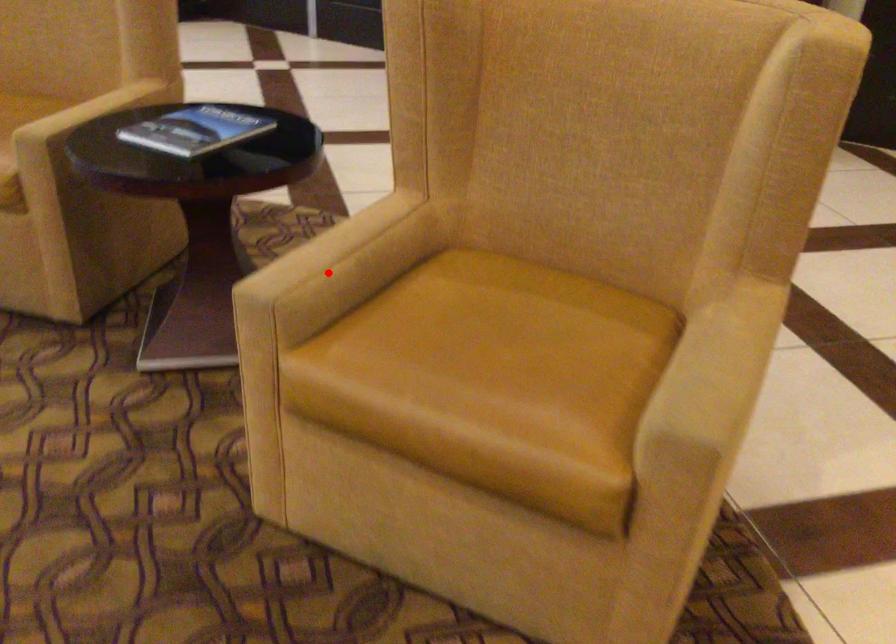
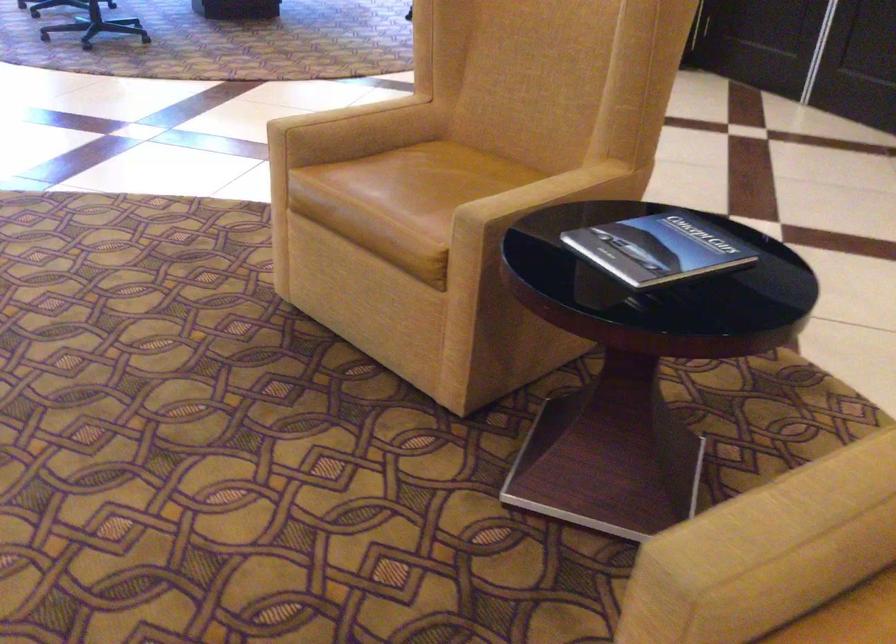
Locate, in the second image, the point that corresponds to the highlighted location in the first image.

(778, 543)